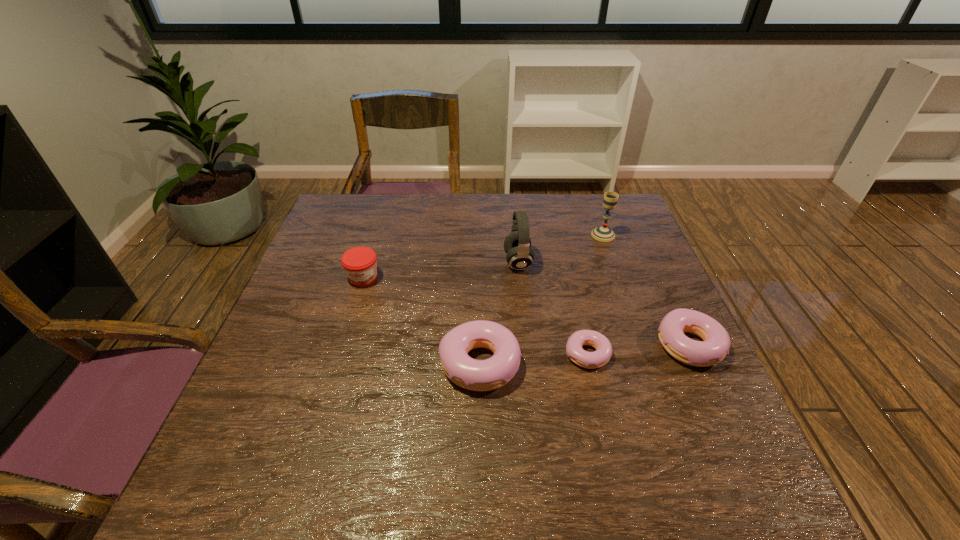
This screenshot has width=960, height=540. I want to click on vacant point located between the second doughnut from right to left and the second shortest object, so click(638, 350).

Identify the location of free space between the farthest object and the jam. Image resolution: width=960 pixels, height=540 pixels. (483, 256).

This screenshot has width=960, height=540. I want to click on free spot between the headset and the farthest object, so click(x=561, y=248).

Where is `vacant area between the farthest object and the headset`? vacant area between the farthest object and the headset is located at coordinates (561, 248).

At what (x,y) coordinates should I click in order to perform the action: click on vacant space in between the second tallest doughnut and the shortest doughnut. Please return your answer as a coordinate pair (x, y). Looking at the image, I should click on (638, 350).

Locate an element on the screen. This screenshot has width=960, height=540. unoccupied area between the headset and the second shortest object is located at coordinates (605, 303).

At what (x,y) coordinates should I click in order to perform the action: click on free space between the fourth object from left to right and the chalice. Please return your answer as a coordinate pair (x, y). This screenshot has width=960, height=540. Looking at the image, I should click on (595, 294).

Where is `object that is the closest one to the rightmost doughnut`? object that is the closest one to the rightmost doughnut is located at coordinates (591, 360).

Identify which object is located as the second nearest to the farthest object. Please provide its 2D coordinates. Your answer should be formatted as a tuple, i.e. [(x, y)], where the tuple contains the x and y coordinates of a point satisfying the conditions above.

[(715, 346)]

Identify which doughnut is the second closest to the headset. Please provide its 2D coordinates. Your answer should be formatted as a tuple, i.e. [(x, y)], where the tuple contains the x and y coordinates of a point satisfying the conditions above.

[(591, 360)]